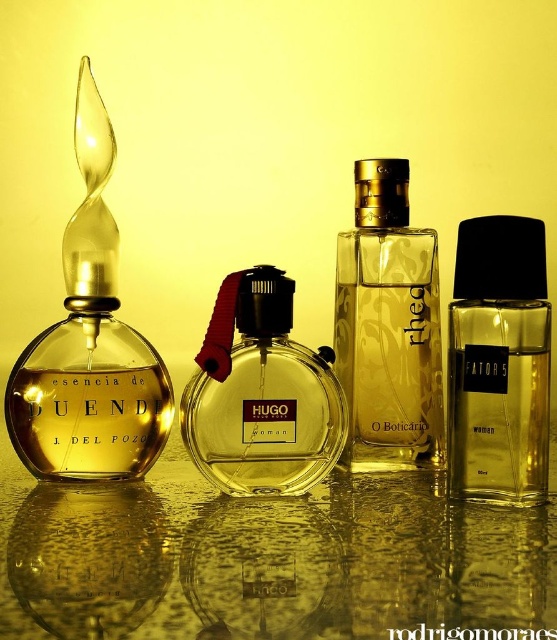
Is point (114, 234) closer to viewer compared to point (412, 372)?

Yes, point (114, 234) is in front of point (412, 372).

Image resolution: width=557 pixels, height=640 pixels. Find the location of `transparent glass bottle at left`. transparent glass bottle at left is located at coordinates (90, 344).

In the scene shown: Can you confirm if transparent glass bottle at center is wider than matte black perfume at center?

No.

Is point (353, 292) closer to viewer compared to point (228, 460)?

No, it is not.

This screenshot has width=557, height=640. I want to click on transparent glass bottle at center, so click(388, 326).

Who is more forward, (1, 528) or (428, 268)?

Point (1, 528)

Is transparent glass table at center wider than transparent glass bottle at center?

Correct, the width of transparent glass table at center exceeds that of transparent glass bottle at center.

Is point (45, 570) more distant than point (355, 394)?

No, (45, 570) is closer to viewer.

Where is `transparent glass table at center`? This screenshot has width=557, height=640. transparent glass table at center is located at coordinates (263, 560).